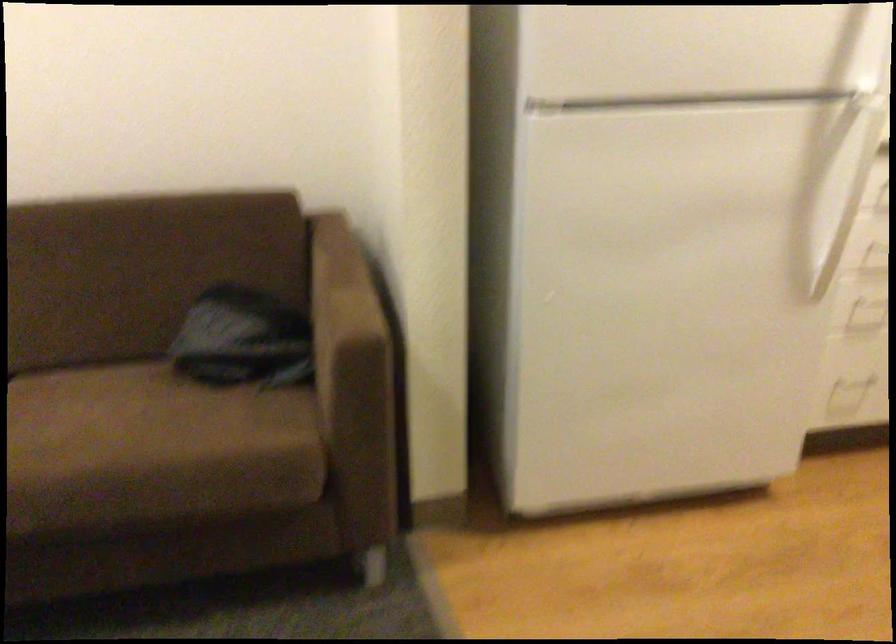
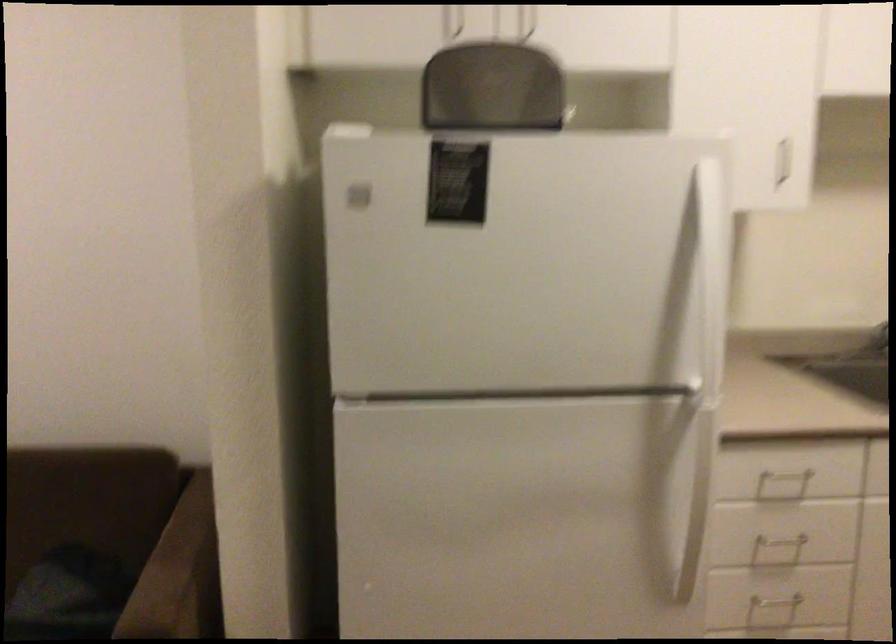
Question: Based on the continuous images, in which direction is the camera rotating? Reply with the corresponding letter.

Choices:
 (A) Left
 (B) Right
 (C) Up
 (D) Down

Answer: (C)